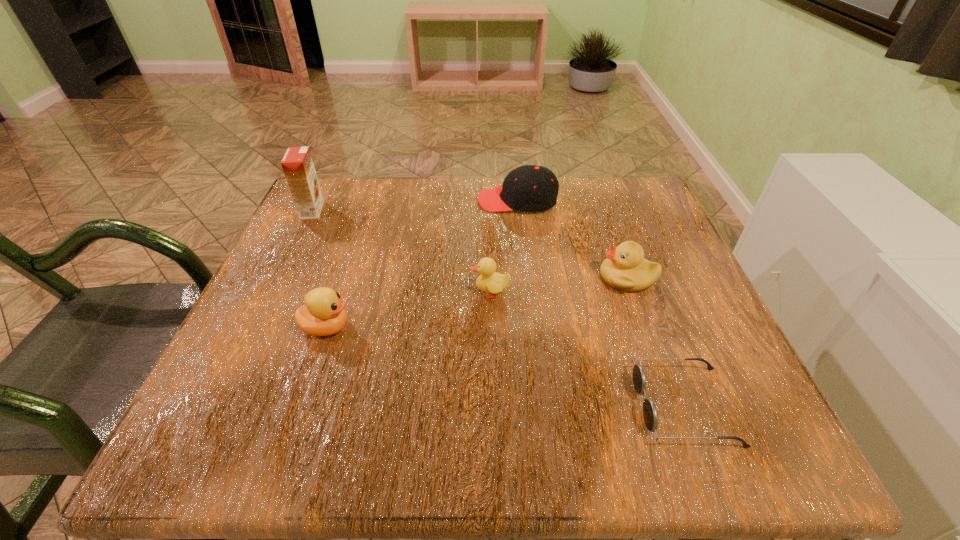
The height and width of the screenshot is (540, 960). What are the coordinates of `the fifth closest object to the cap` in the screenshot? It's located at (650, 415).

This screenshot has height=540, width=960. Find the location of `object that is the fifth closest to the orange juice`. object that is the fifth closest to the orange juice is located at coordinates (650, 415).

Identify the location of duckling that stands as the third closest to the cap. This screenshot has height=540, width=960. (323, 314).

Choose which duckling is the third nearest neighbor to the shortest object. Please provide its 2D coordinates. Your answer should be formatted as a tuple, i.e. [(x, y)], where the tuple contains the x and y coordinates of a point satisfying the conditions above.

[(323, 314)]